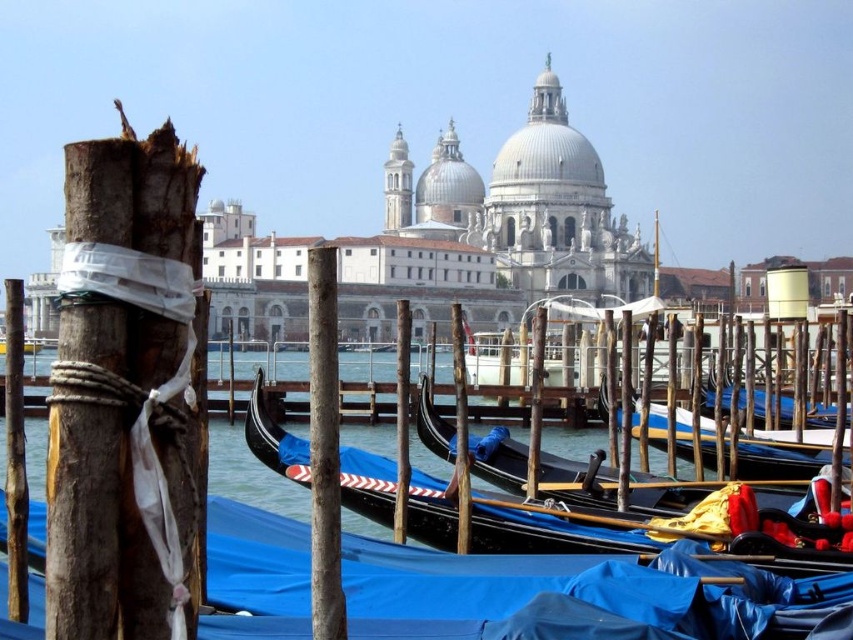
You are a tourist standing at the dock in Venice. You see a black polished gondola at center and a wooden gondola at center. Which gondola is positioned to the left?

The black polished gondola at center is positioned to the left of the wooden gondola at center.

You are standing on the dock in Venice and see both the black polished gondola at center and the wooden gondola at center. Which gondola is closer to you?

The black polished gondola at center is closer to you because it is in front of the wooden gondola at center.

You are a tourist standing on the dock in Venice and see both the black polished gondola at center and the wooden gondola at center. Which gondola is larger in size?

The wooden gondola at center is larger than the black polished gondola at center.